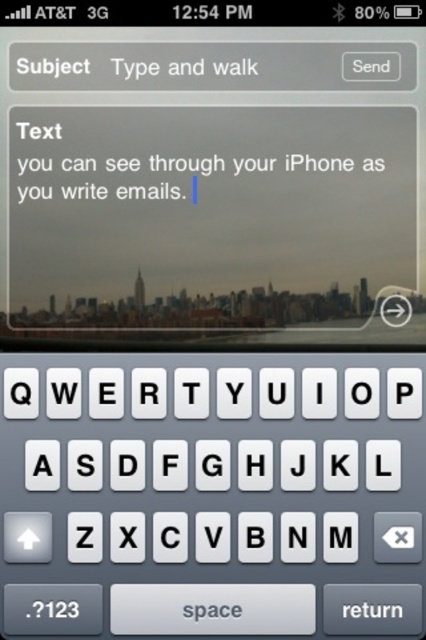
You are composing an email on your iPhone and notice two overlapping text elements. The first is a transparent glass text field at center and the second is a transparent plastic text at center. Which one is positioned lower on the screen?

The transparent glass text field at center is positioned lower than the transparent plastic text at center.

You are trying to compose an email on your phone and notice two text fields at the center. The first is labeled as transparent glass text field at center, and the second is transparent plastic text at center. Which text field is wider?

The transparent glass text field at center is wider than the transparent plastic text at center according to the description.